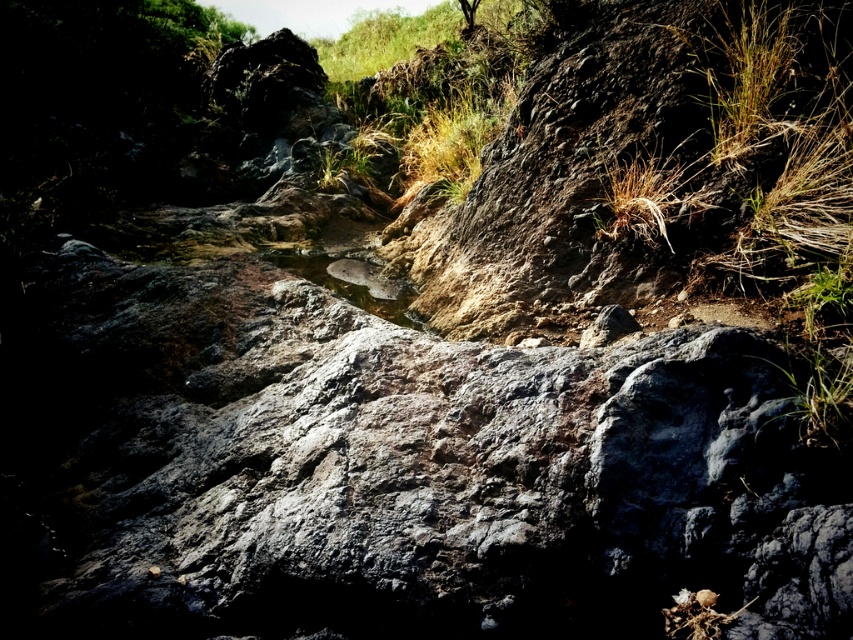
You are an explorer trying to cross the stream in this rugged outdoor scene. You see the dry grass at upper center and the greenish reflective water at center. Which object is bigger in size?

The dry grass at upper center is larger in size than the greenish reflective water at center.